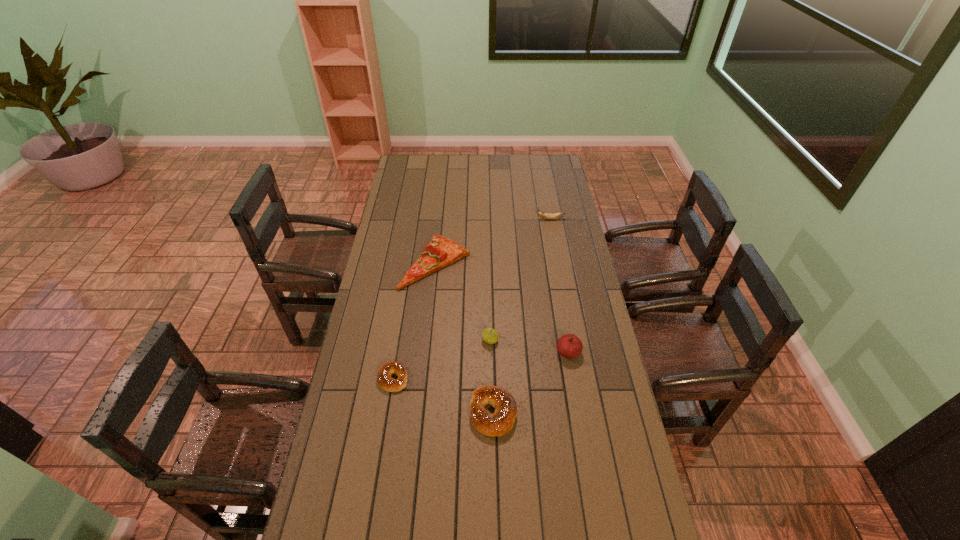
You are a GUI agent. You are given a task and a screenshot of the screen. Output one action in this format:
    pyautogui.click(x=<x>, y=<y>)
    Task: Click on the free space that satisfies the following two spatial constraints: 1. on the front side of the pizza; 2. on the right side of the pear
    
    Given the screenshot: What is the action you would take?
    pyautogui.click(x=428, y=340)